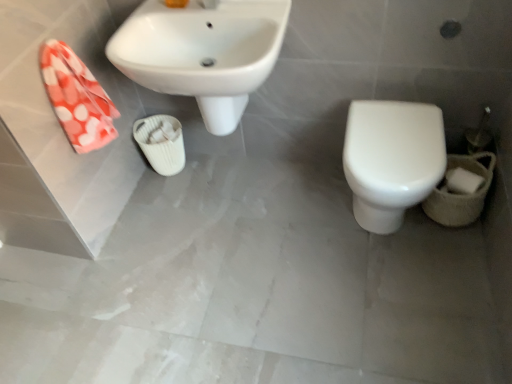
What are the coordinates of `vacant area that is in front of white ribbed cup at center` in the screenshot? It's located at (169, 194).